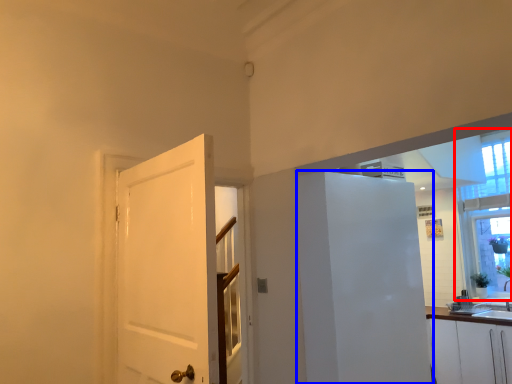
Question: Which point is further to the camera, window (highlighted by a red box) or elevator (highlighted by a blue box)?

Choices:
 (A) window
 (B) elevator

Answer: (A)